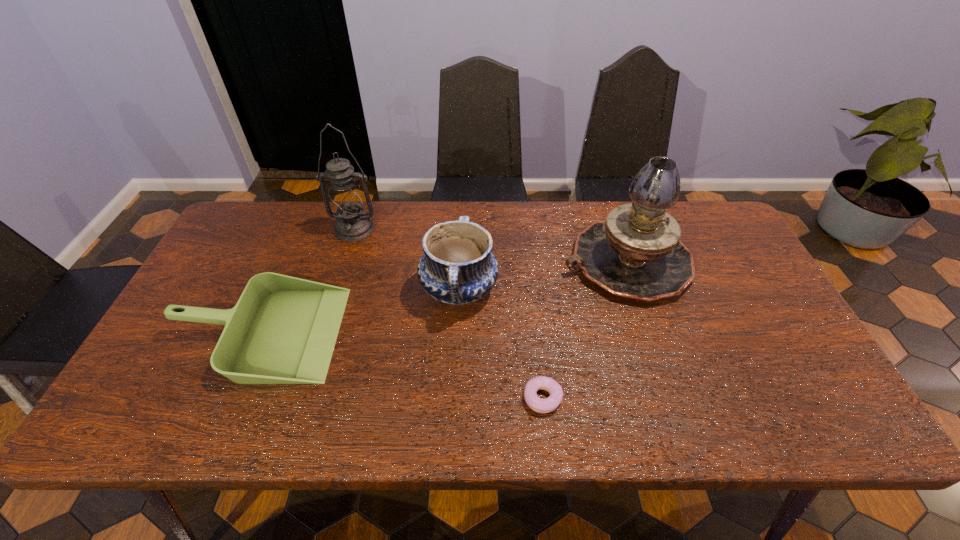
This screenshot has height=540, width=960. Find the location of `free point between the pottery and the left oil lamp`. free point between the pottery and the left oil lamp is located at coordinates (407, 259).

The width and height of the screenshot is (960, 540). Identify the location of vacant space that is in between the dustpan and the doughnut. (401, 365).

At what (x,y) coordinates should I click in order to perform the action: click on vacant point located between the rightmost object and the third shortest object. Please return your answer as a coordinate pair (x, y). This screenshot has height=540, width=960. Looking at the image, I should click on (542, 276).

In order to click on vacant space that is in between the third tallest object and the rightmost object in this screenshot , I will do `click(542, 276)`.

Identify which object is the second nearest to the dustpan. Please provide its 2D coordinates. Your answer should be formatted as a tuple, i.e. [(x, y)], where the tuple contains the x and y coordinates of a point satisfying the conditions above.

[(457, 267)]

I want to click on object that is the fourth nearest to the right oil lamp, so click(x=283, y=329).

Where is `free space that satisfies the following two spatial constraints: 1. on the front side of the left oil lamp; 2. on the left side of the shortest object`? The height and width of the screenshot is (540, 960). free space that satisfies the following two spatial constraints: 1. on the front side of the left oil lamp; 2. on the left side of the shortest object is located at coordinates (302, 398).

At what (x,y) coordinates should I click in order to perform the action: click on free space in the image that satisfies the following two spatial constraints: 1. on the scoop of the second shortest object; 2. on the right side of the second object from right to left. Please return your answer as a coordinate pair (x, y). The height and width of the screenshot is (540, 960). Looking at the image, I should click on (231, 398).

Where is `vacant region that satisfies the following two spatial constraints: 1. on the front side of the third object from right to left; 2. on the scoop of the dustpan`? The width and height of the screenshot is (960, 540). vacant region that satisfies the following two spatial constraints: 1. on the front side of the third object from right to left; 2. on the scoop of the dustpan is located at coordinates (457, 332).

You are a GUI agent. You are given a task and a screenshot of the screen. Output one action in this format:
    pyautogui.click(x=<x>, y=<y>)
    Task: Click on the vacant area that satisfies the following two spatial constraints: 1. on the scoop of the second object from right to left; 2. on the left side of the dustpan
    
    Given the screenshot: What is the action you would take?
    pyautogui.click(x=231, y=398)